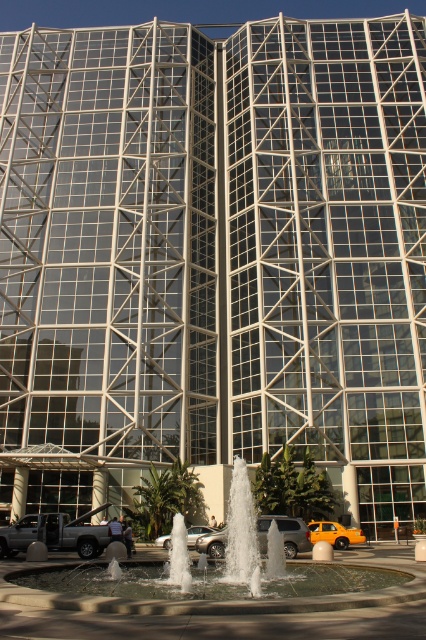
Question: Is white stone fountain at center above metallic silver suv at center?

Choices:
 (A) yes
 (B) no

Answer: (A)

Question: Among these objects, which one is nearest to the camera?

Choices:
 (A) white stone fountain at center
 (B) silver metallic truck at lower left
 (C) silver metallic sedan at center

Answer: (A)

Question: Can you confirm if metallic silver suv at center is wider than silver metallic sedan at center?

Choices:
 (A) no
 (B) yes

Answer: (B)

Question: Which point is closer to the camera?

Choices:
 (A) (221, 557)
 (B) (201, 525)

Answer: (A)

Question: Does metallic silver suv at center have a larger size compared to silver metallic sedan at center?

Choices:
 (A) no
 (B) yes

Answer: (A)

Question: Which of the following is the closest to the observer?

Choices:
 (A) (103, 525)
 (B) (411, 589)
 (C) (222, 554)
 (D) (330, 538)

Answer: (B)